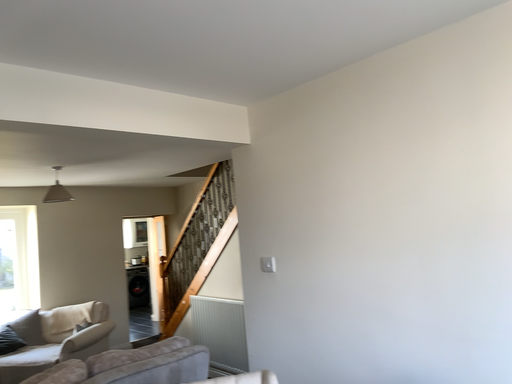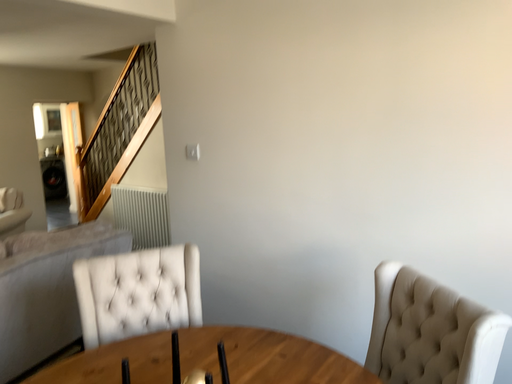
Question: How did the camera likely rotate when shooting the video?

Choices:
 (A) rotated downward
 (B) rotated upward

Answer: (A)